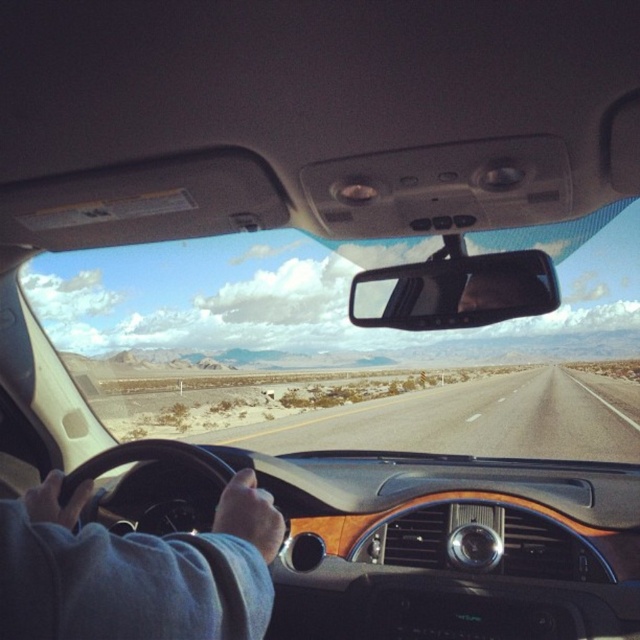
Is transparent glass windshield at center to the left of black plastic view mirror at center from the viewer's perspective?

No, transparent glass windshield at center is not to the left of black plastic view mirror at center.

Locate an element on the screen. transparent glass windshield at center is located at coordinates (317, 342).

Who is lower down, transparent glass windshield at center or blue fleece jacket at lower left?

blue fleece jacket at lower left is lower down.

Looking at this image, who is more forward, (573, 291) or (237, 637)?

Positioned in front is point (237, 637).

Find the location of a particular element. transparent glass windshield at center is located at coordinates (317, 342).

Between blue fleece jacket at lower left and asphalt road at center, which one appears on the left side from the viewer's perspective?

blue fleece jacket at lower left is more to the left.

Does blue fleece jacket at lower left come in front of asphalt road at center?

Yes, it is.

Find the location of a particular element. This screenshot has height=640, width=640. blue fleece jacket at lower left is located at coordinates (134, 572).